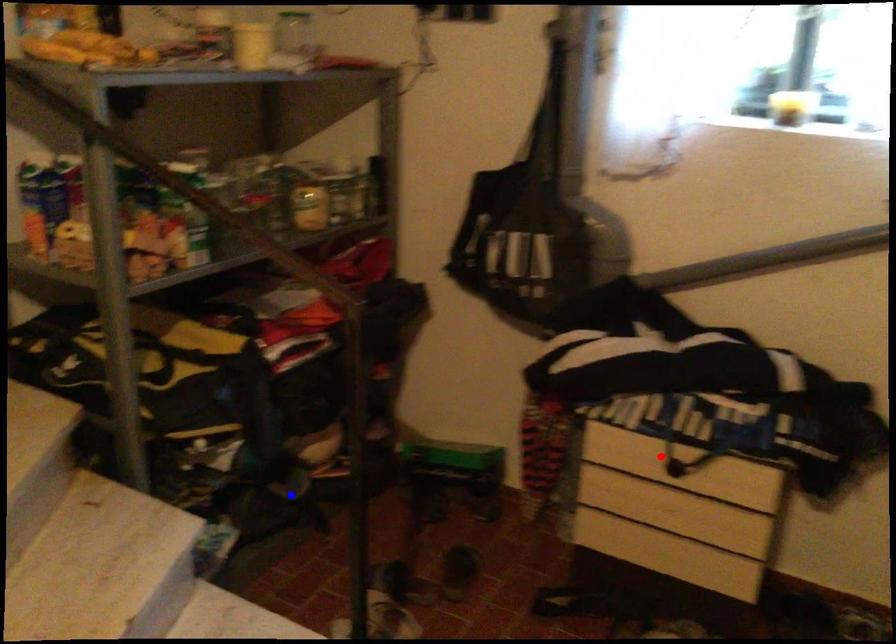
Question: Which of the two points in the image is closer to the camera?

Choices:
 (A) Blue point is closer.
 (B) Red point is closer.

Answer: (B)